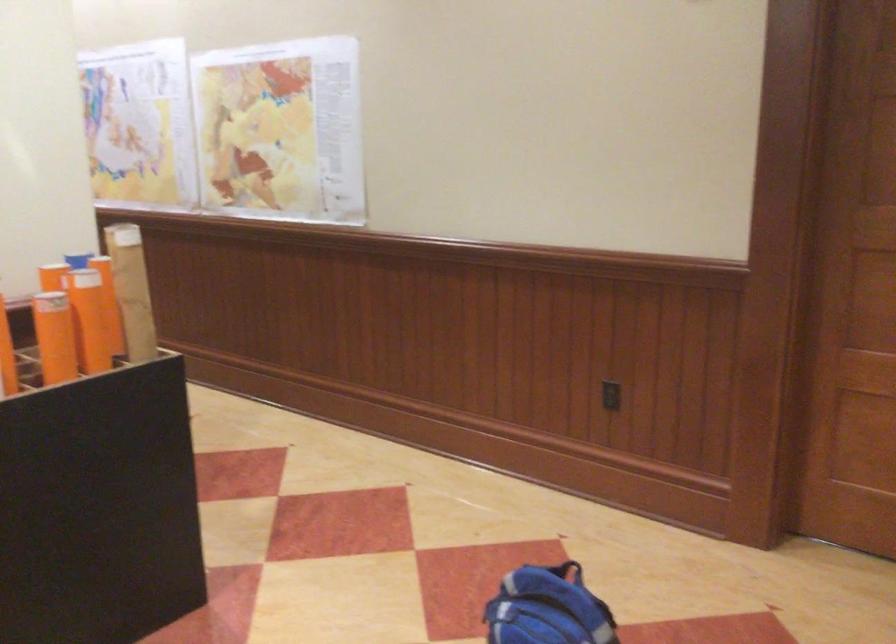
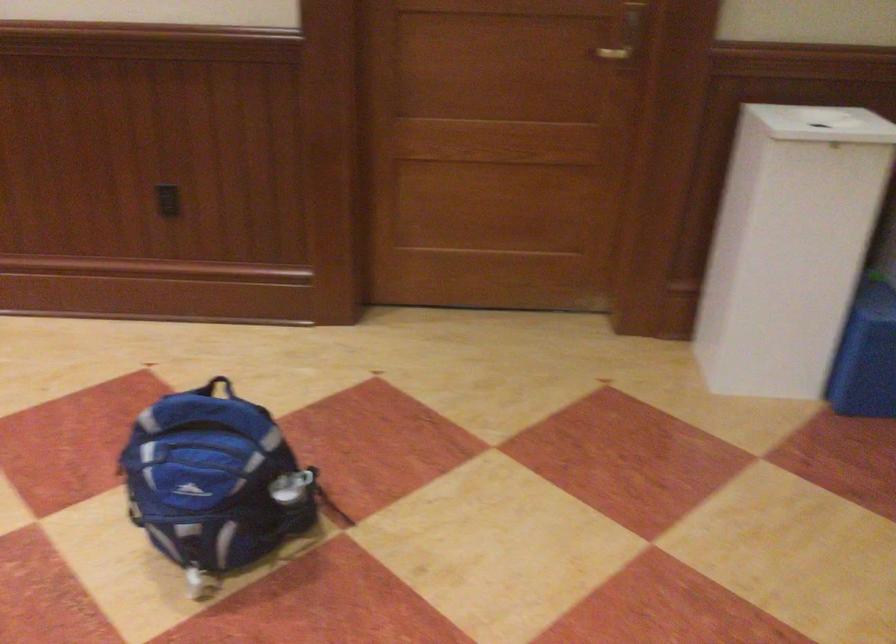
Question: Based on the continuous images, in which direction is the camera rotating? Reply with the corresponding letter.

Choices:
 (A) Left
 (B) Right
 (C) Up
 (D) Down

Answer: (B)